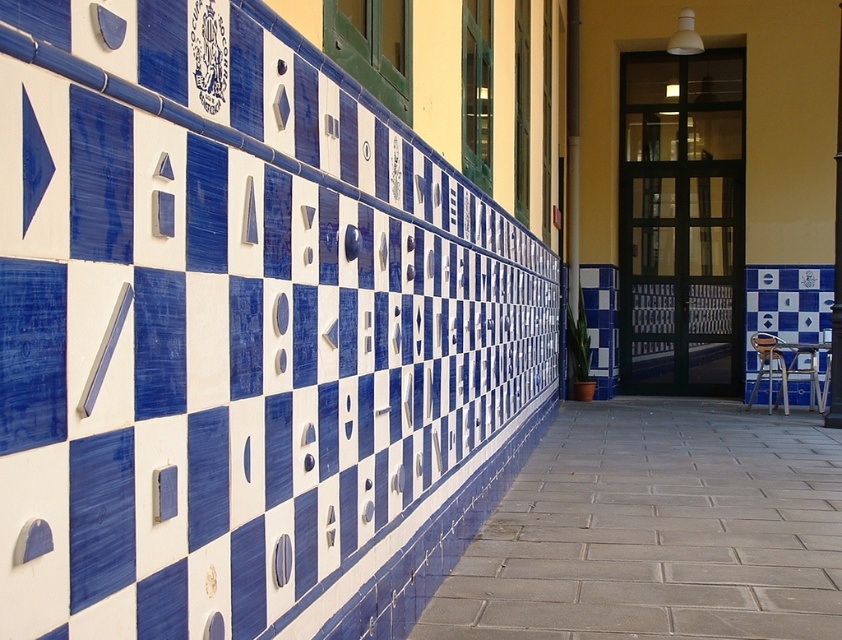
You are standing 10 feet away from the building wall. Can you reach the blue glossy tiles at upper left with a 10.5 feet long pole?

The blue glossy tiles at upper left are 10.98 feet away from the viewer. Since the pole is only 10.5 feet long, it is not long enough to reach the blue glossy tiles at upper left.

You are an architect designing a new building and want to replicate the blue glossy tiles pattern from the image. If the blue glossy tiles at upper left are 3.20 meters away from the blue glossy tile at center, how far apart should you place them in your design to maintain the same spacing?

The blue glossy tiles at upper left and blue glossy tile at center are 3.20 meters apart, so you should place them 3.20 meters apart in your design to maintain the same spacing.

You are standing in front of the building and want to place a metallic silver chair at lower right so that it is directly under the blue glossy tiles at upper left. Is this possible based on the current arrangement?

Yes, since the blue glossy tiles at upper left are already located above the metallic silver chair at lower right, placing the chair there would align it directly underneath.